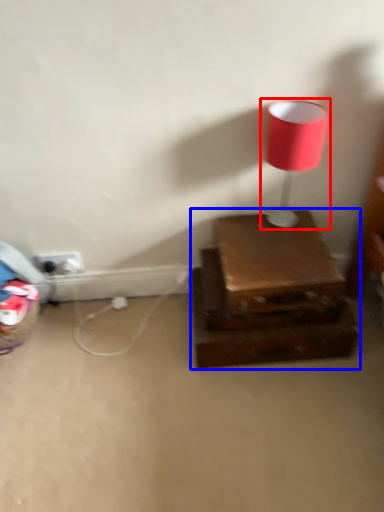
Question: Which object is further to the camera taking this photo, lamp (highlighted by a red box) or furniture (highlighted by a blue box)?

Choices:
 (A) lamp
 (B) furniture

Answer: (B)